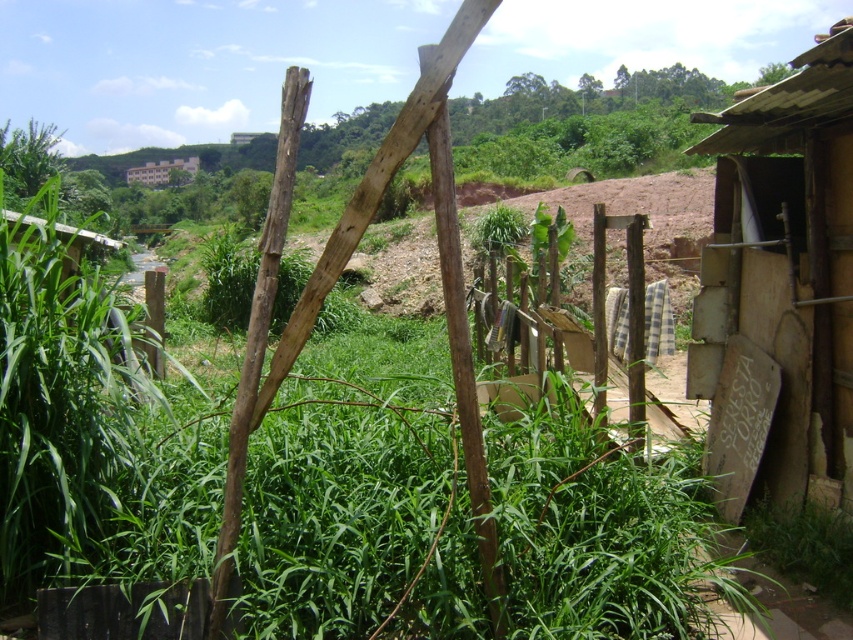
Question: Observing the image, what is the correct spatial positioning of wooden shack at right in reference to brown wooden hut at upper center?

Choices:
 (A) above
 (B) below

Answer: (B)

Question: Considering the real-world distances, which object is closest to the brown wooden hut at upper center?

Choices:
 (A) wooden fence at center
 (B) wooden shack at right

Answer: (A)

Question: Is wooden shack at right wider than wooden fence at center?

Choices:
 (A) yes
 (B) no

Answer: (A)

Question: Observing the image, what is the correct spatial positioning of wooden fence at center in reference to brown wooden hut at upper center?

Choices:
 (A) below
 (B) above

Answer: (A)

Question: Which of these objects is positioned closest to the brown wooden hut at upper center?

Choices:
 (A) wooden shack at right
 (B) wooden fence at center

Answer: (B)

Question: Which of these objects is positioned closest to the wooden fence at center?

Choices:
 (A) brown wooden hut at upper center
 (B) wooden shack at right

Answer: (B)